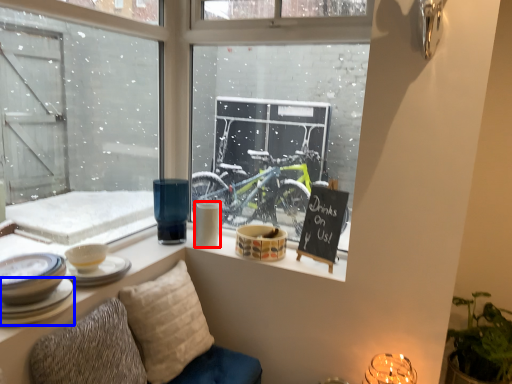
Question: Which of the following is the farthest to the observer, tableware (highlighted by a red box) or tableware (highlighted by a blue box)?

Choices:
 (A) tableware
 (B) tableware

Answer: (A)